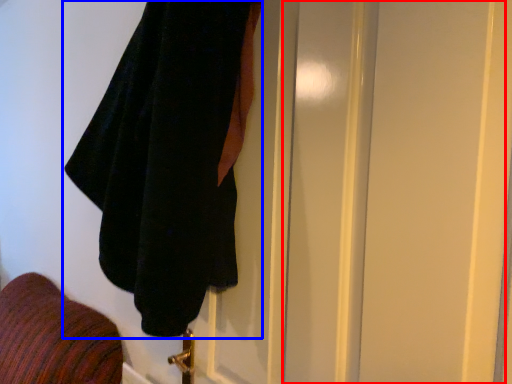
Question: Among these objects, which one is farthest to the camera, screen door (highlighted by a red box) or towel (highlighted by a blue box)?

Choices:
 (A) screen door
 (B) towel

Answer: (B)